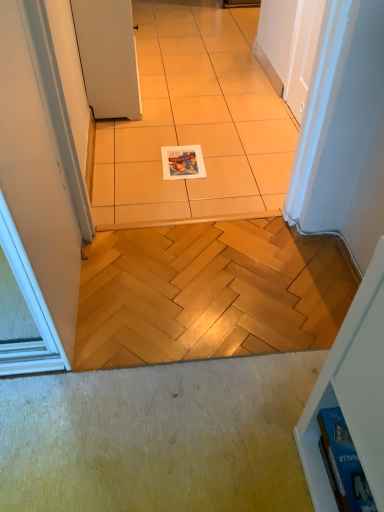
The height and width of the screenshot is (512, 384). Identify the location of free point to the right of matte paper magazine at center, which is the 2th magazine from front to back. (232, 166).